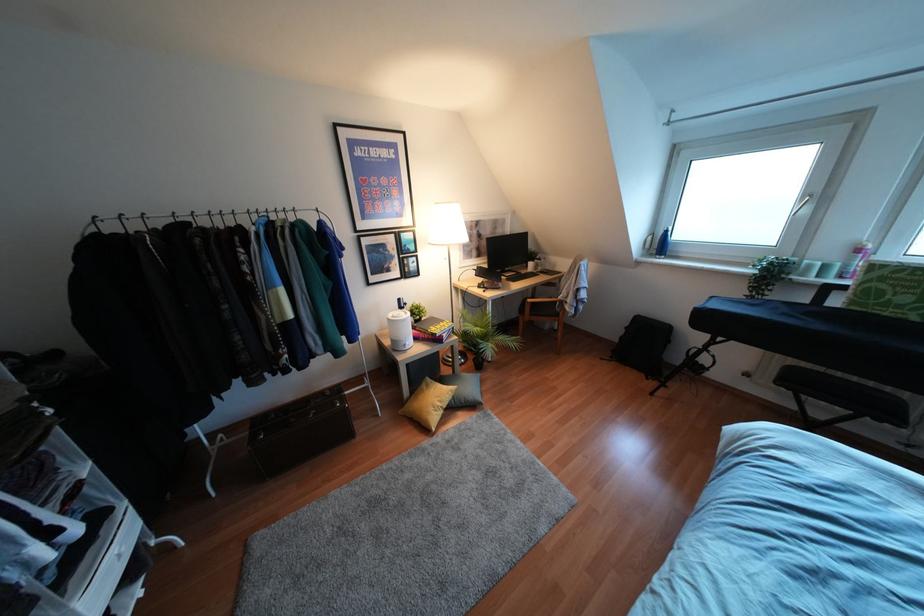
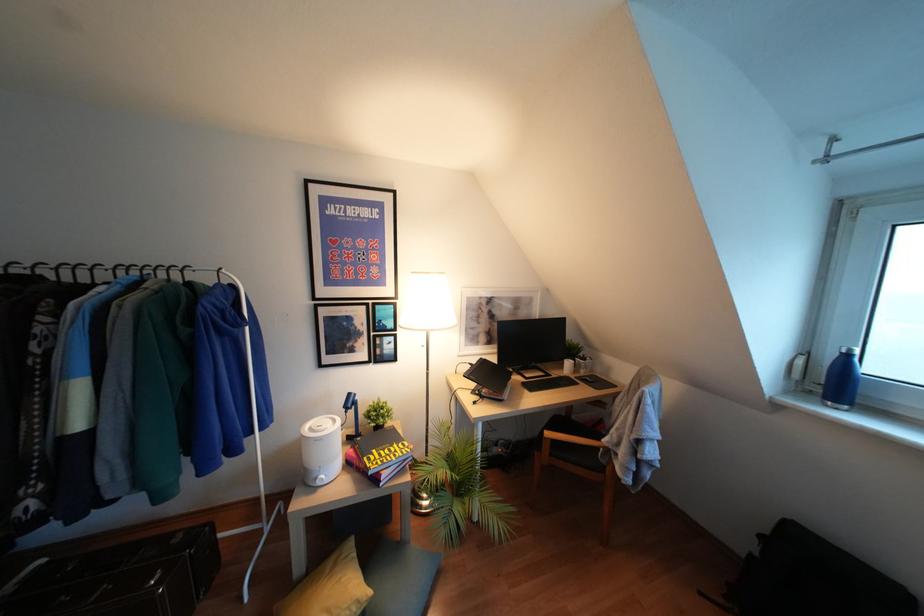
Question: How did the camera likely rotate?

Choices:
 (A) Left
 (B) Right
 (C) Up
 (D) Down

Answer: (A)